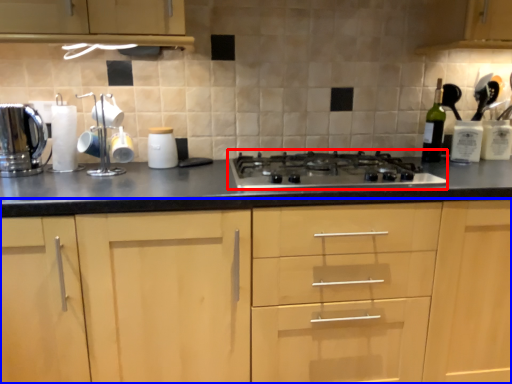
Question: Which object is closer to the camera taking this photo, gas stove (highlighted by a red box) or cabinetry (highlighted by a blue box)?

Choices:
 (A) gas stove
 (B) cabinetry

Answer: (B)